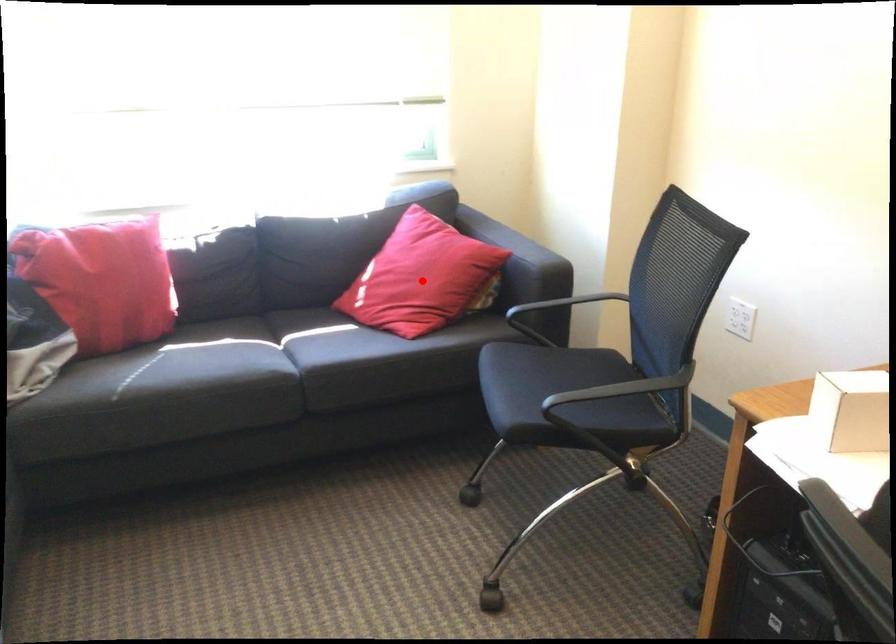
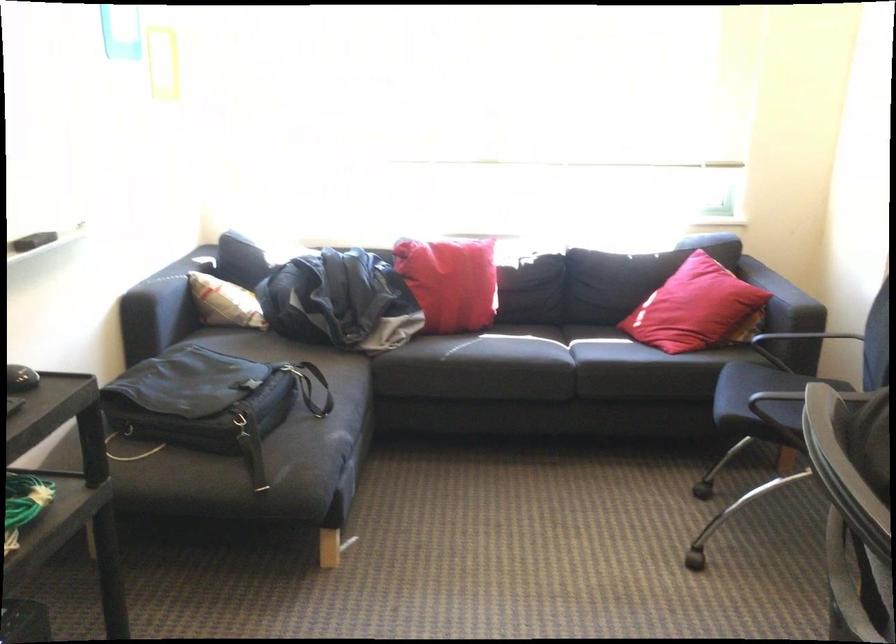
Question: I am providing you with two images of the same scene from different viewpoints. Image1 has a red point marked. In image2, the corresponding 3D location appears at what relative position? Reply with the corresponding letter.

Choices:
 (A) Closer
 (B) Farther

Answer: (B)